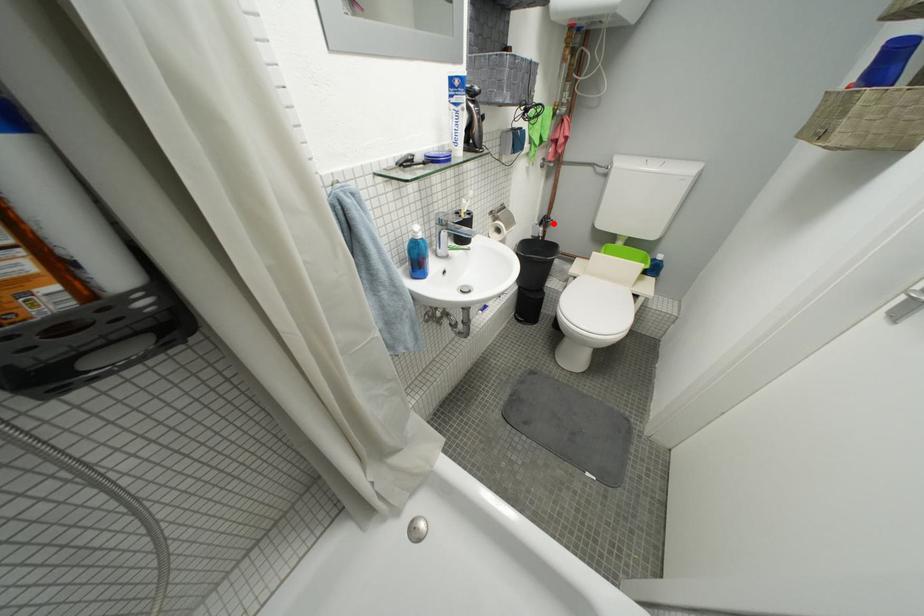
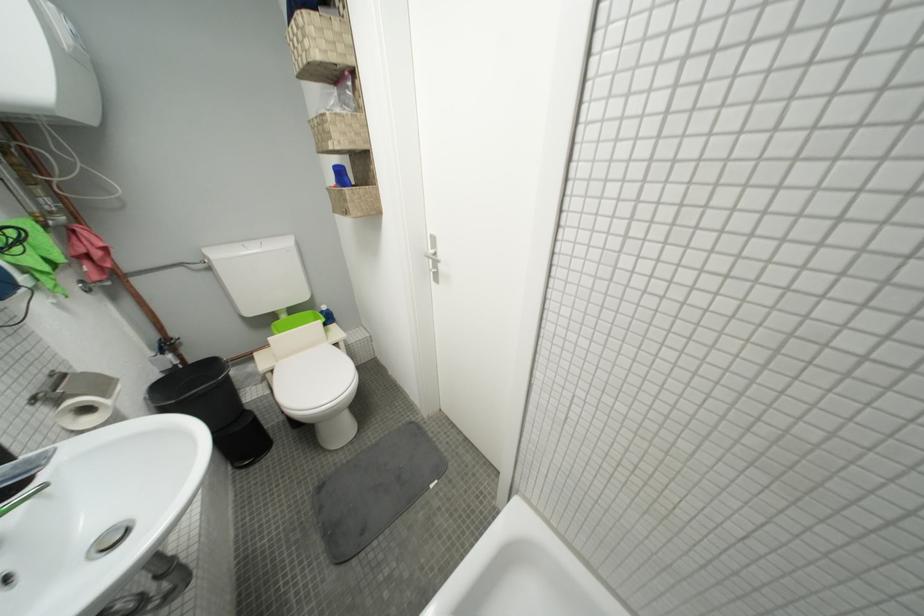
Question: I am providing you with two images of the same scene from different viewpoints. In image1, a red point is highlighted. Considering the same 3D point in image2, which of the following is correct?

Choices:
 (A) It is closer
 (B) It is farther

Answer: (B)